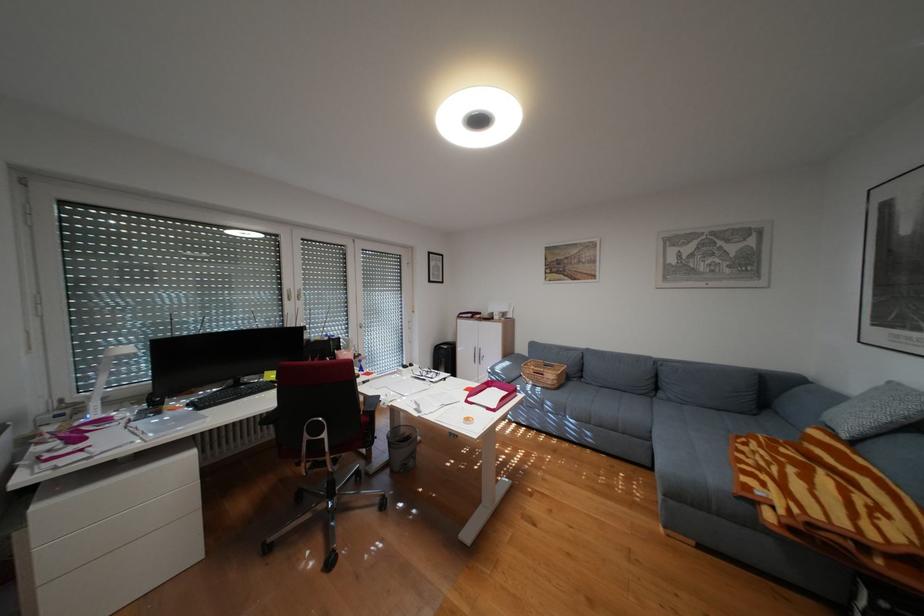
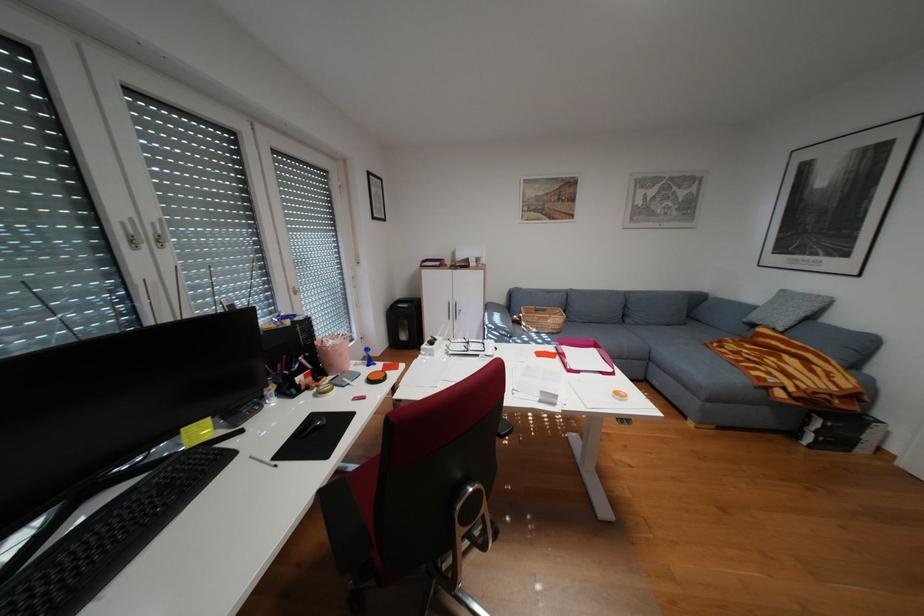
Find the pixel in the second image that matches [490,315] in the first image.

(460, 262)